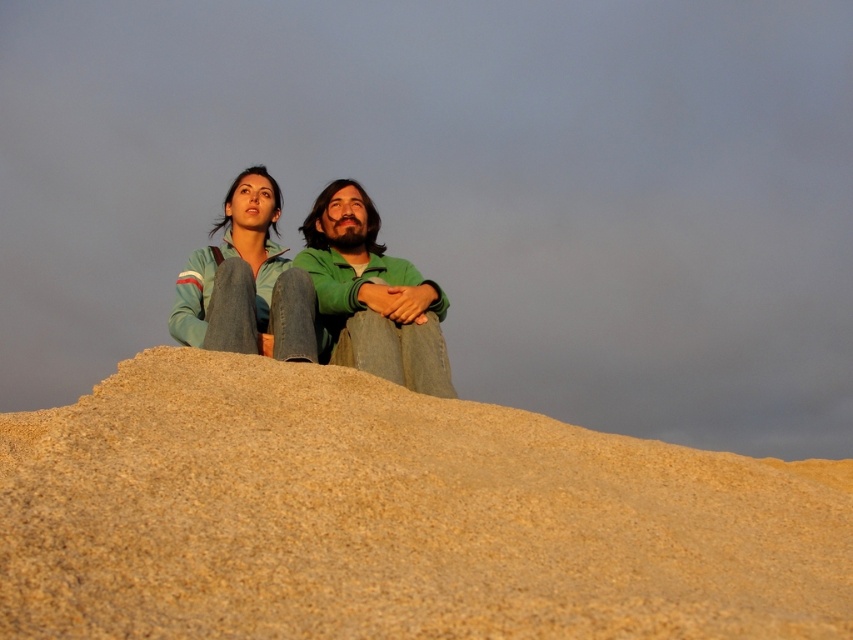
You are a photographer planning to take a photo of the scene. You want to ensure that both the fine sand mound at center and the green matte jacket at center are in focus. Your camera has a depth of field that can cover 2.5 meters. Will both objects be in focus?

The distance between the fine sand mound at center and the green matte jacket at center is 2.45 meters, which is within the camera depth of field of 2.5 meters. Therefore, both objects will be in focus.

You are planning to build a sandcastle on the fine sand mound at center. However, you also have a denim jacket at upper center that you need to place nearby. Considering their sizes, which object should you prioritize placing first to ensure there is enough space?

The fine sand mound at center has a smaller size compared to the denim jacket at upper center, so you should prioritize placing the denim jacket at upper center first to ensure there is enough space for both objects.

You are a photographer trying to capture both the green matte jacket at center and the denim jacket at upper center in a single frame. Based on their positions, which jacket will appear larger in the photo?

The green matte jacket at center will appear larger in the photo because it is much taller than the denim jacket at upper center.